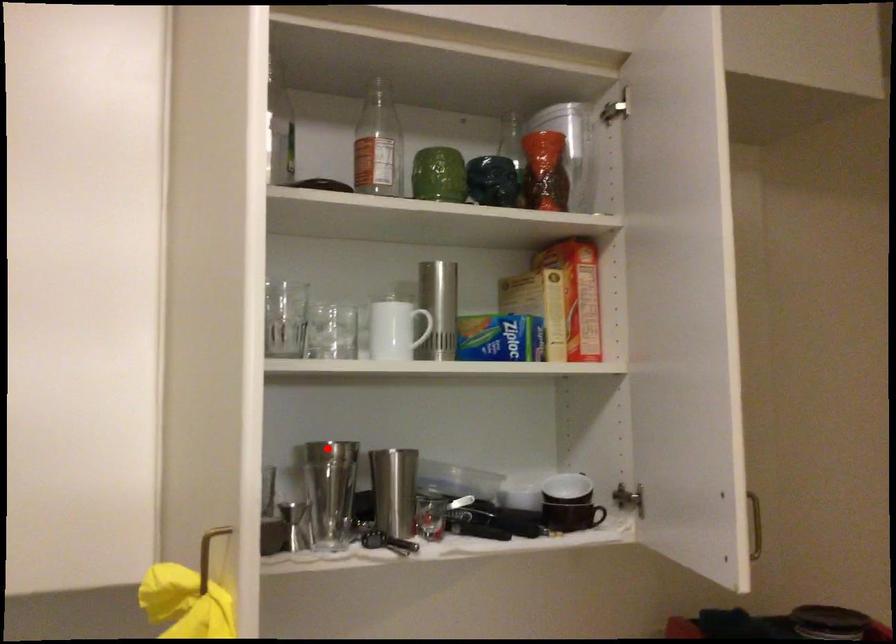
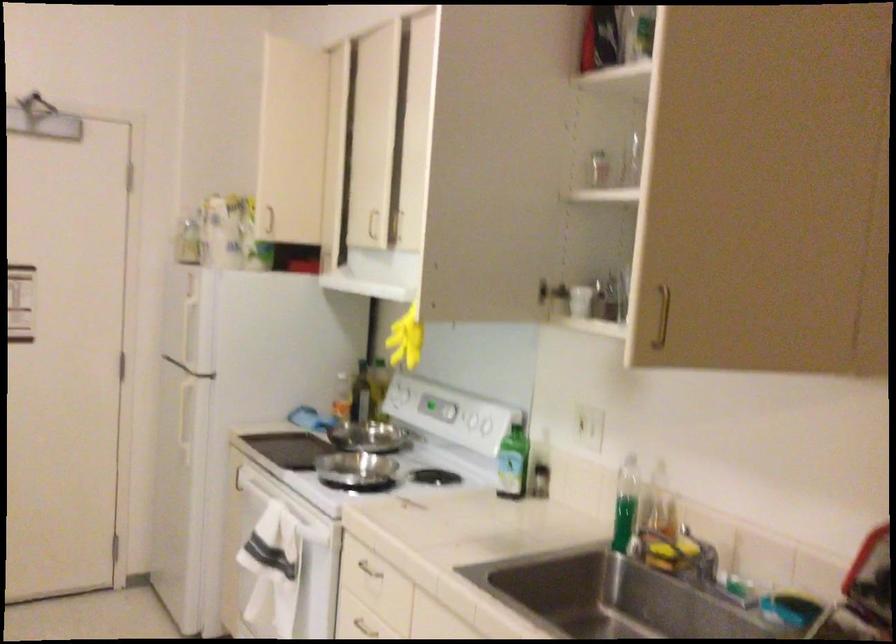
Question: I am providing you with two images of the same scene from different viewpoints. A red point is marked on the first image. At the location where the point appears in image 1, is it still visible in image 2?

Choices:
 (A) Yes
 (B) No

Answer: (B)